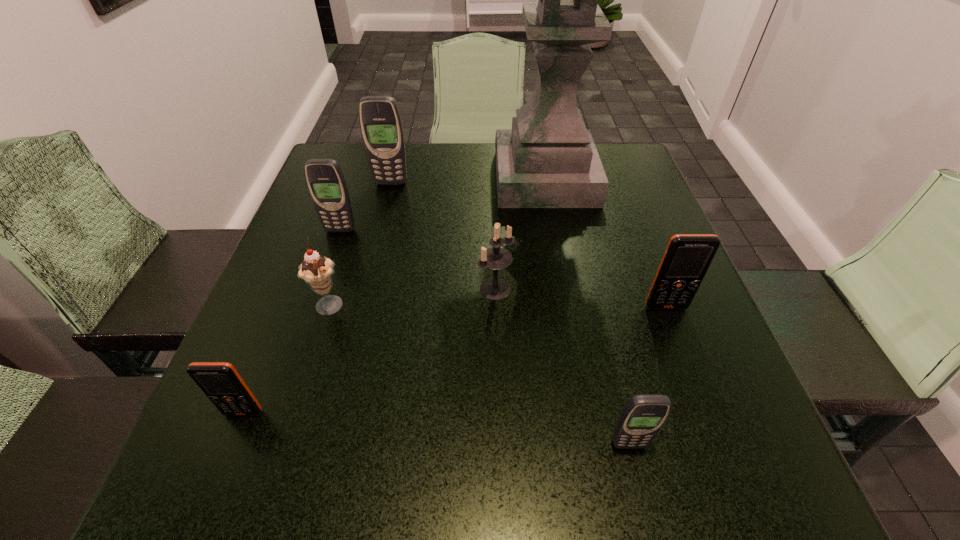
Choose which cellular telephone is the fourth nearest neighbor to the sculpture. Please provide its 2D coordinates. Your answer should be formatted as a tuple, i.e. [(x, y)], where the tuple contains the x and y coordinates of a point satisfying the conditions above.

[(643, 416)]

Identify which cellular telephone is located as the fourth nearest to the nearest object. Please provide its 2D coordinates. Your answer should be formatted as a tuple, i.e. [(x, y)], where the tuple contains the x and y coordinates of a point satisfying the conditions above.

[(381, 126)]

Choose which gray cellular telephone is the second nearest neighbor to the icecream. Please provide its 2D coordinates. Your answer should be formatted as a tuple, i.e. [(x, y)], where the tuple contains the x and y coordinates of a point satisfying the conditions above.

[(381, 126)]

The width and height of the screenshot is (960, 540). Find the location of `gray cellular telephone identified as the closest to the second biggest gray cellular telephone`. gray cellular telephone identified as the closest to the second biggest gray cellular telephone is located at coordinates (381, 126).

Where is `vacant space that satisfies the following two spatial constraints: 1. at the front opening of the sculpture; 2. on the screen of the leftmost gray cellular telephone`? This screenshot has height=540, width=960. vacant space that satisfies the following two spatial constraints: 1. at the front opening of the sculpture; 2. on the screen of the leftmost gray cellular telephone is located at coordinates (555, 230).

This screenshot has height=540, width=960. Identify the location of free space that satisfies the following two spatial constraints: 1. on the screen of the leftmost gray cellular telephone; 2. on the left side of the icecream. (314, 307).

You are a GUI agent. You are given a task and a screenshot of the screen. Output one action in this format:
    pyautogui.click(x=<x>, y=<y>)
    Task: Click on the vacant area in the image that satisfies the following two spatial constraints: 1. at the front opening of the tallest object; 2. on the screen of the left orange cellular telephone
    Image resolution: width=960 pixels, height=540 pixels.
    Given the screenshot: What is the action you would take?
    pyautogui.click(x=588, y=413)